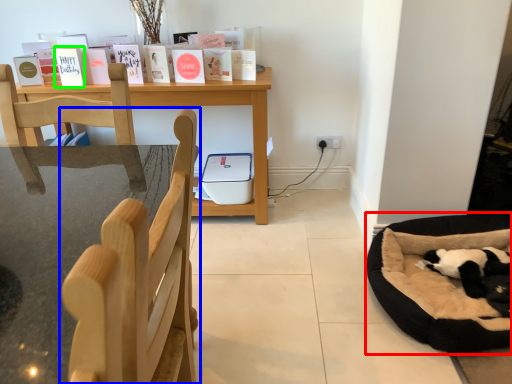
Question: Which object is the farthest from dog bed (highlighted by a red box)? Choose among these: chair (highlighted by a blue box) or paperback book (highlighted by a green box).

Choices:
 (A) chair
 (B) paperback book

Answer: (B)